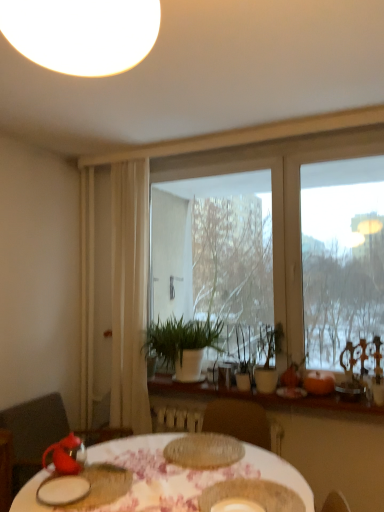
Locate an element on the screen. The height and width of the screenshot is (512, 384). vacant point to the right of white ceramic plate at lower left, which appears as the 9th tableware when viewed from the right is located at coordinates (118, 490).